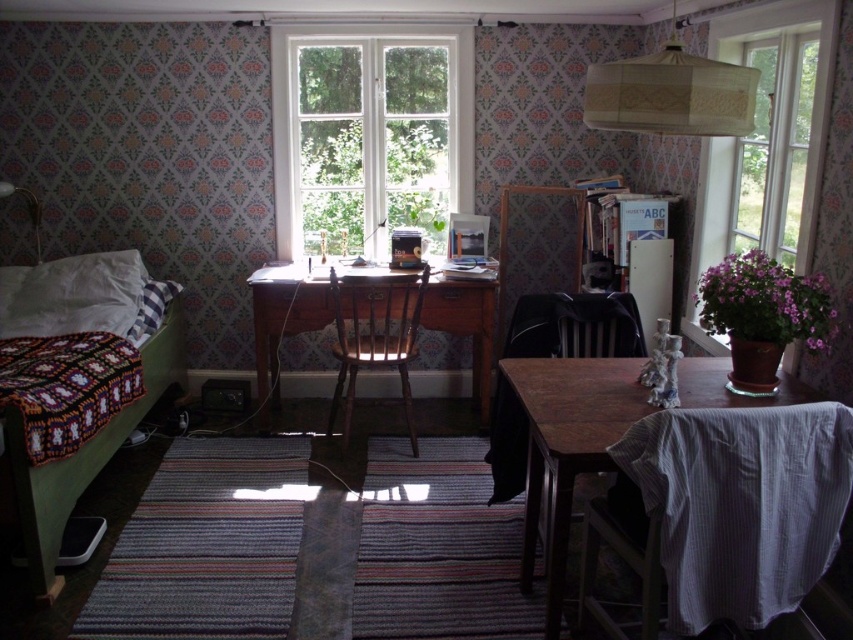
Question: Is dark wood chair at lower center positioned in front of wooden chair at center?

Choices:
 (A) yes
 (B) no

Answer: (A)

Question: Does transparent glass window at right have a greater width compared to knitted fabric bed at left?

Choices:
 (A) yes
 (B) no

Answer: (A)

Question: Which of these objects is positioned farthest from the matte white lampshade at upper center?

Choices:
 (A) wooden table at lower right
 (B) wooden chair at center
 (C) transparent glass window at right
 (D) beige fabric lampshade at upper center

Answer: (C)

Question: Which point is closer to the camera?

Choices:
 (A) (582, 397)
 (B) (415, 323)
 (C) (755, 51)

Answer: (A)

Question: Among these points, which one is nearest to the camera?

Choices:
 (A) (117, 420)
 (B) (740, 401)

Answer: (B)

Question: Can you confirm if wooden table at lower right is bigger than matte white lampshade at upper center?

Choices:
 (A) yes
 (B) no

Answer: (A)